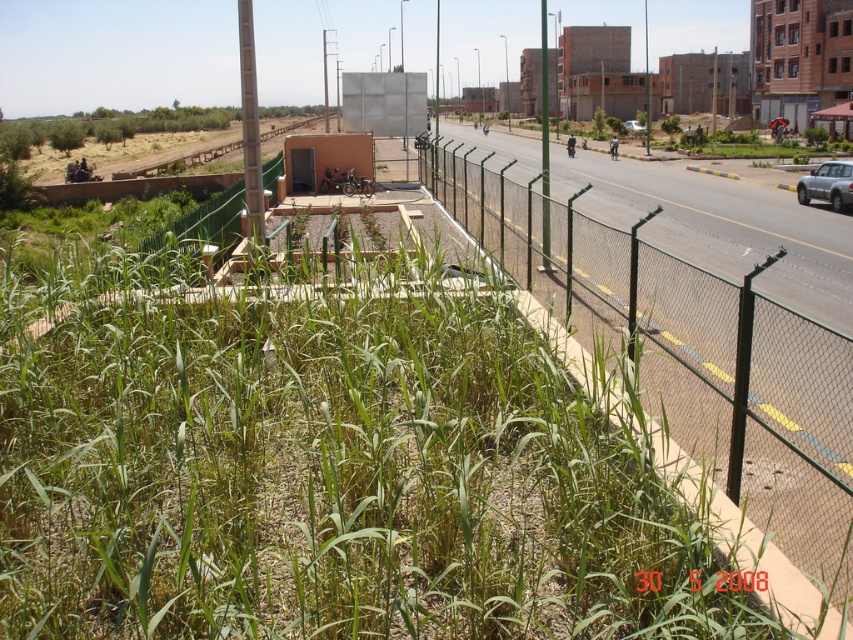
You are a GUI agent. You are given a task and a screenshot of the screen. Output one action in this format:
    pyautogui.click(x=<x>, y=<y>)
    Task: Click on the green chain-link fence at right
    
    Given the screenshot: What is the action you would take?
    pyautogui.click(x=689, y=355)

Is green chain-link fence at right thinner than satin silver car at right?

No, green chain-link fence at right is not thinner than satin silver car at right.

Who is more distant from viewer, (721, 316) or (842, 196)?

Point (842, 196)

Find the location of a particular element. This screenshot has height=640, width=853. green chain-link fence at right is located at coordinates (689, 355).

Does green wire mesh fence at right appear on the left side of satin silver car at right?

Indeed, green wire mesh fence at right is positioned on the left side of satin silver car at right.

Does green wire mesh fence at right have a greater width compared to satin silver car at right?

Indeed, green wire mesh fence at right has a greater width compared to satin silver car at right.

Describe the element at coordinates (722, 227) in the screenshot. I see `green wire mesh fence at right` at that location.

Identify the location of green wire mesh fence at right. (722, 227).

Does point (498, 500) come closer to viewer compared to point (486, 166)?

That is True.

Does green grass at lower left have a larger size compared to green chain-link fence at right?

No, green grass at lower left is not bigger than green chain-link fence at right.

Between point (479, 472) and point (729, 378), which one is positioned in front?

Point (479, 472)

At what (x,y) coordinates should I click in order to perform the action: click on green grass at lower left. Please return your answer as a coordinate pair (x, y). The width and height of the screenshot is (853, 640). Looking at the image, I should click on (323, 472).